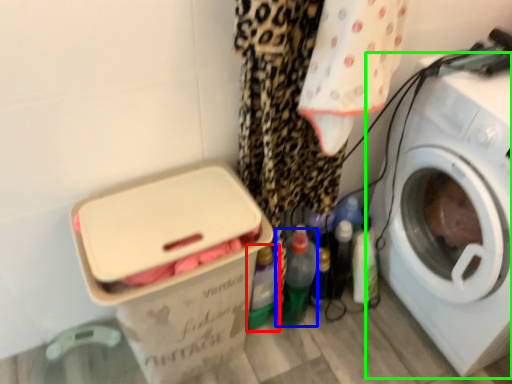
Question: Which is nearer to the bottle (highlighted by a red box)? bottle (highlighted by a blue box) or washing machine (highlighted by a green box).

Choices:
 (A) bottle
 (B) washing machine

Answer: (A)